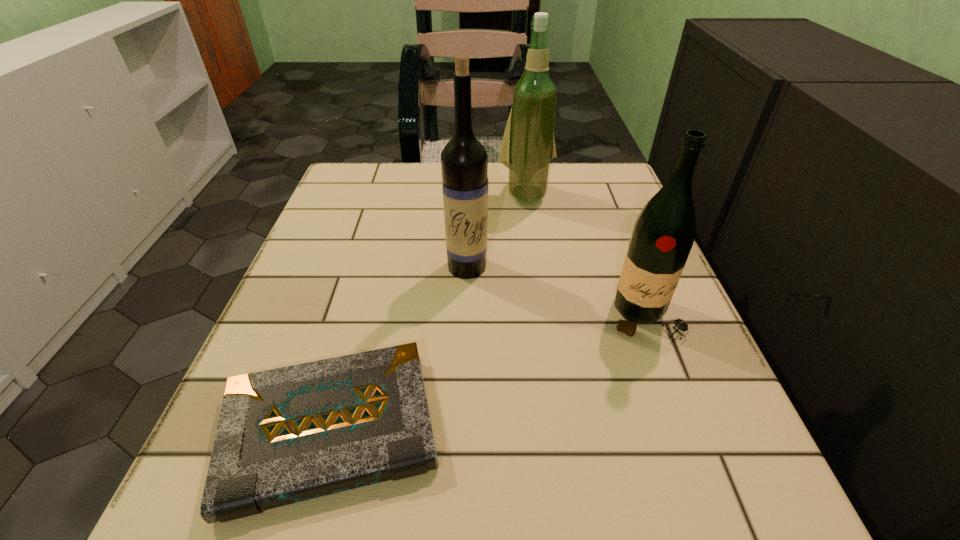
At what (x,y) coordinates should I click in order to perform the action: click on free location located on the surface of the shortest wine bottle. Please return your answer as a coordinate pair (x, y). Looking at the image, I should click on (727, 535).

Where is `free space located 0.060m on the right of the nearest object`? free space located 0.060m on the right of the nearest object is located at coordinates (488, 429).

Locate an element on the screen. object located in the far edge section of the desktop is located at coordinates (528, 145).

Identify the location of object present at the near edge. (290, 434).

Find the location of a particular element. The width and height of the screenshot is (960, 540). object that is positioned at the left edge is located at coordinates (290, 434).

Locate an element on the screen. The width and height of the screenshot is (960, 540). object present at the right edge is located at coordinates (663, 235).

Image resolution: width=960 pixels, height=540 pixels. Find the location of `object located at the near left corner`. object located at the near left corner is located at coordinates pyautogui.click(x=290, y=434).

Identify the location of free region at the far edge. (412, 199).

Locate an element on the screen. This screenshot has width=960, height=540. vacant area at the near edge of the desktop is located at coordinates (565, 501).

Find the location of `free space at the right edge of the desktop`. free space at the right edge of the desktop is located at coordinates (655, 437).